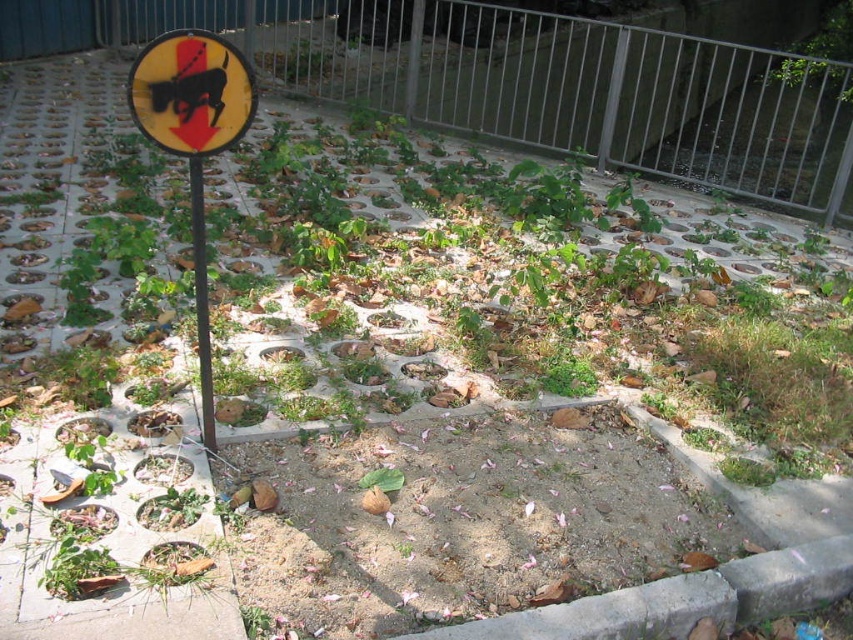
Question: Which of these objects is positioned farthest from the yellow reflective sign at upper left?

Choices:
 (A) black metal pole at center-left
 (B) metallic gray fence at upper center

Answer: (B)

Question: Which point is farther to the camera?

Choices:
 (A) (189, 38)
 (B) (231, 104)
 (C) (192, 230)
 (D) (833, 138)

Answer: (D)

Question: Which point is closer to the camera?

Choices:
 (A) pyautogui.click(x=347, y=3)
 (B) pyautogui.click(x=183, y=129)
 (C) pyautogui.click(x=200, y=262)

Answer: (B)

Question: Observing the image, what is the correct spatial positioning of metallic gray fence at upper center in reference to yellow matte sign at upper left?

Choices:
 (A) above
 (B) below

Answer: (A)

Question: Is yellow matte sign at upper left to the left of yellow reflective sign at upper left from the viewer's perspective?

Choices:
 (A) no
 (B) yes

Answer: (B)

Question: Does metallic gray fence at upper center appear on the left side of yellow matte sign at upper left?

Choices:
 (A) yes
 (B) no

Answer: (B)